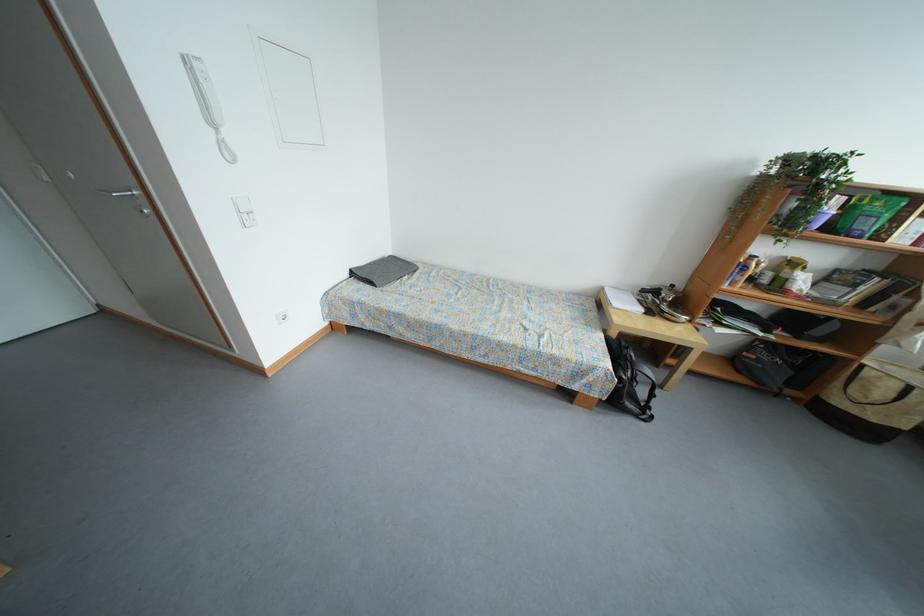
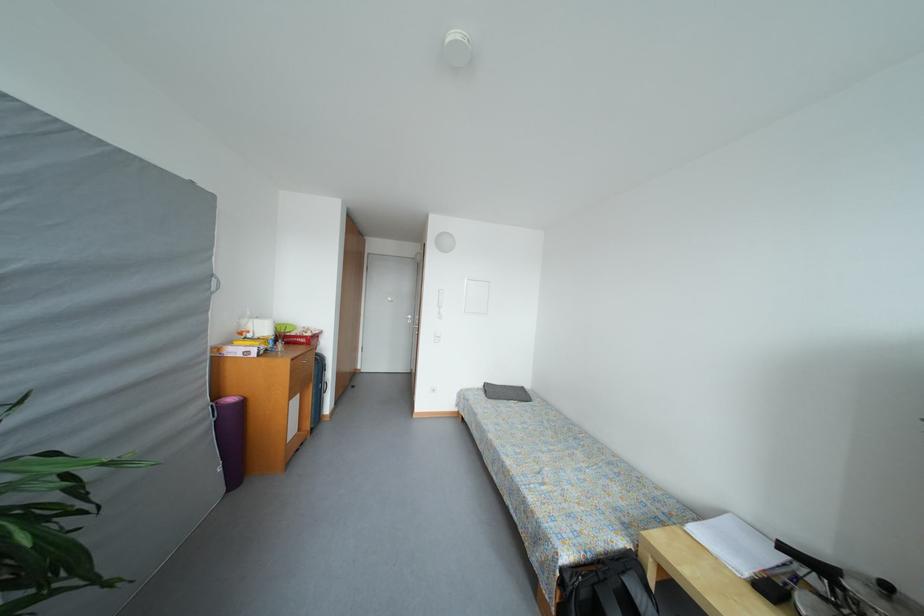
Locate, in the second image, the point that corresponds to [678,291] in the first image.

(893, 591)